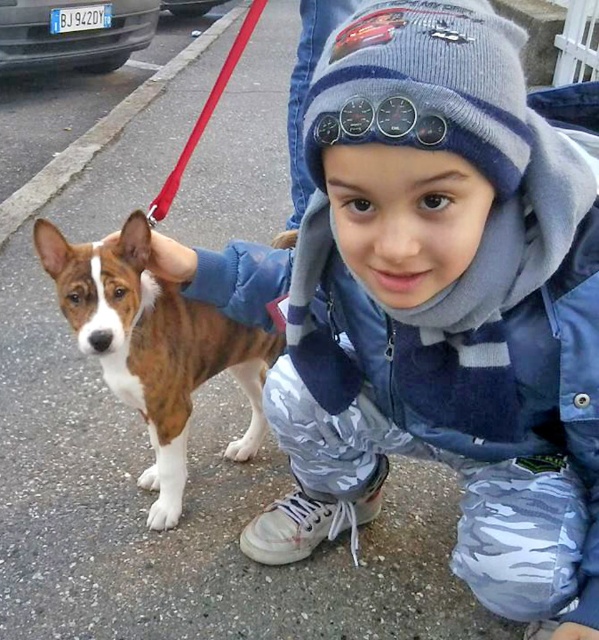
From the picture: You are standing at the point labeled point (238, 40) and want to walk to the point labeled point (147, 396). Which direction should you move?

You should move forward because point (147, 396) is in front of point (238, 40).

In the scene shown: You are a photographer trying to capture a clear photo of the brown brindle fur at center and the red nylon leash at upper center. Which object should you focus on first to ensure both are in focus?

The brown brindle fur at center should be focused on first since it is in front of the red nylon leash at upper center, ensuring both will be in focus when starting with the closer object.